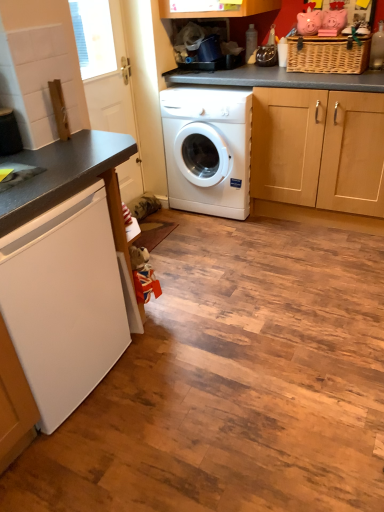
Locate an element on the screen. This screenshot has width=384, height=512. free space in front of white glossy washing machine at center, which ranks as the 2th washing machine in bottom-to-top order is located at coordinates (221, 239).